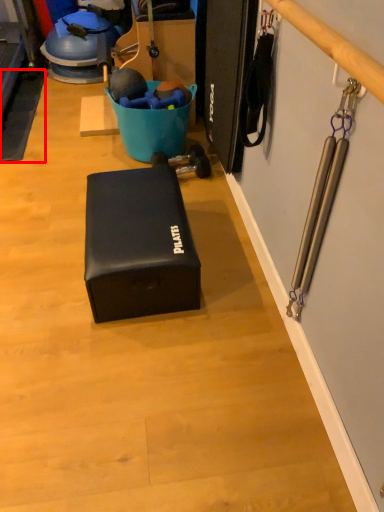
Question: Observing the image, what is the correct spatial positioning of yoga mat (annotated by the red box) in reference to box?

Choices:
 (A) right
 (B) left

Answer: (B)